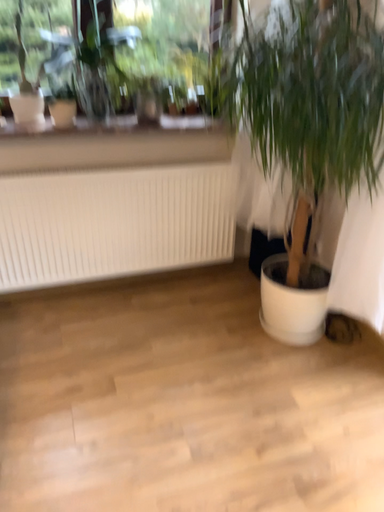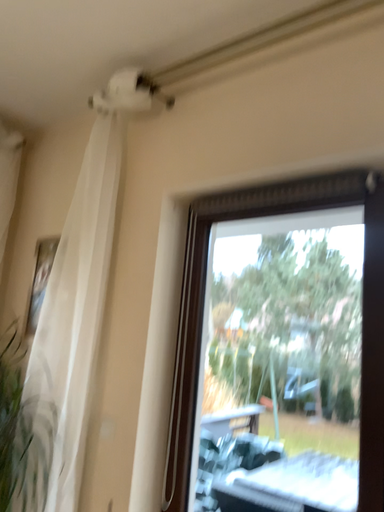
Question: Which way did the camera rotate in the video?

Choices:
 (A) rotated upward
 (B) rotated downward

Answer: (A)